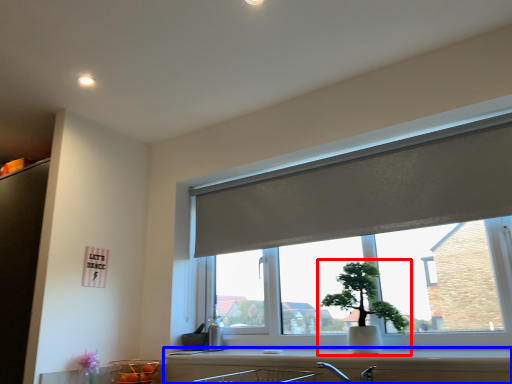
Question: Which object appears farthest to the camera in this image, houseplant (highlighted by a red box) or counter top (highlighted by a blue box)?

Choices:
 (A) houseplant
 (B) counter top

Answer: (A)